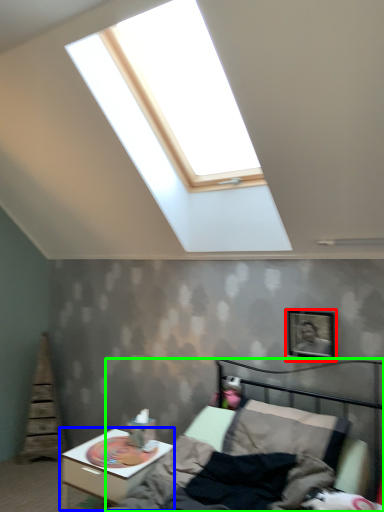
Question: Based on their relative distances, which object is farther from picture frame (highlighted by a red box)? Choose from nightstand (highlighted by a blue box) and bed (highlighted by a green box).

Choices:
 (A) nightstand
 (B) bed

Answer: (A)